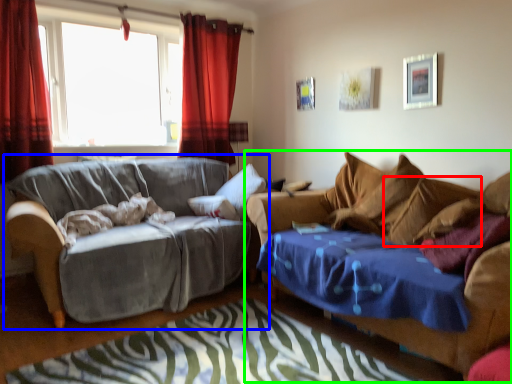
Question: Which object is positioned farthest from pillow (highlighted by a red box)? Select from studio couch (highlighted by a blue box) and studio couch (highlighted by a green box).

Choices:
 (A) studio couch
 (B) studio couch

Answer: (A)